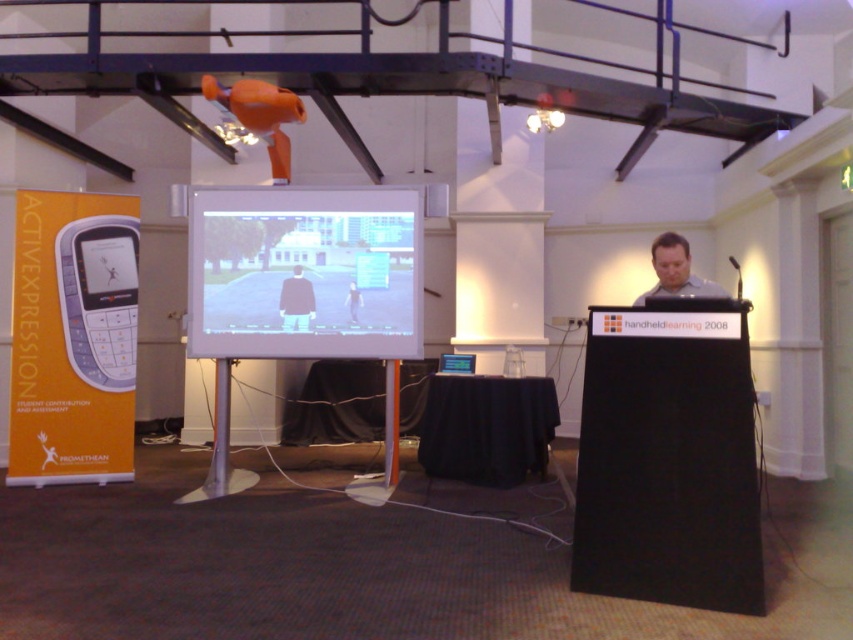
You are a participant in the presentation and you see the point at coordinates [109,262]. Which object is this point located on?

The point at coordinates [109,262] is located on the matte black phone at center left.